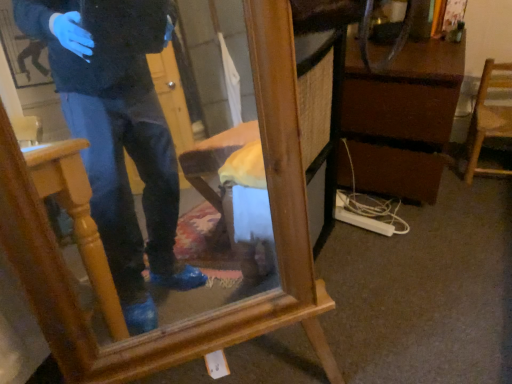
This screenshot has height=384, width=512. In order to click on vacant space in front of wooden chair at right in this screenshot , I will do point(489,200).